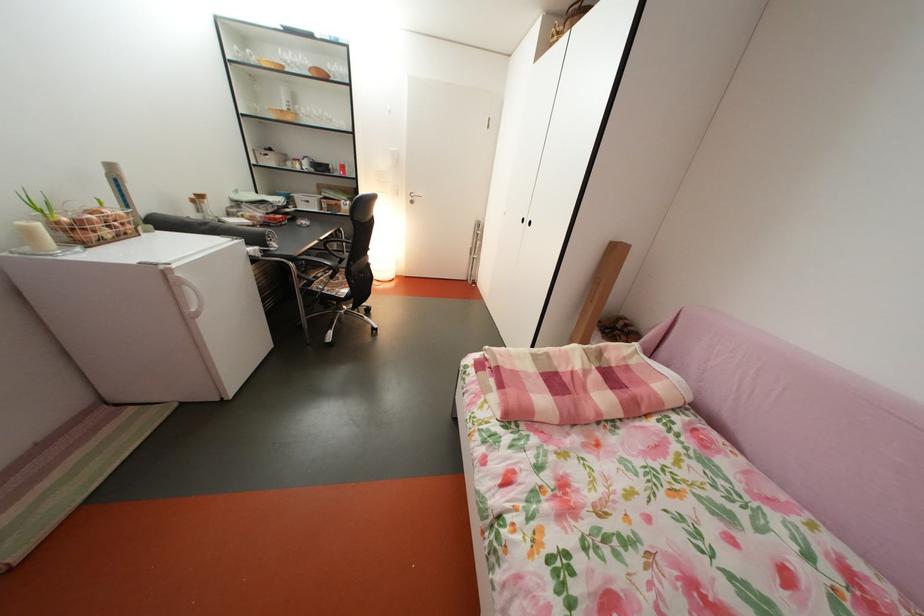
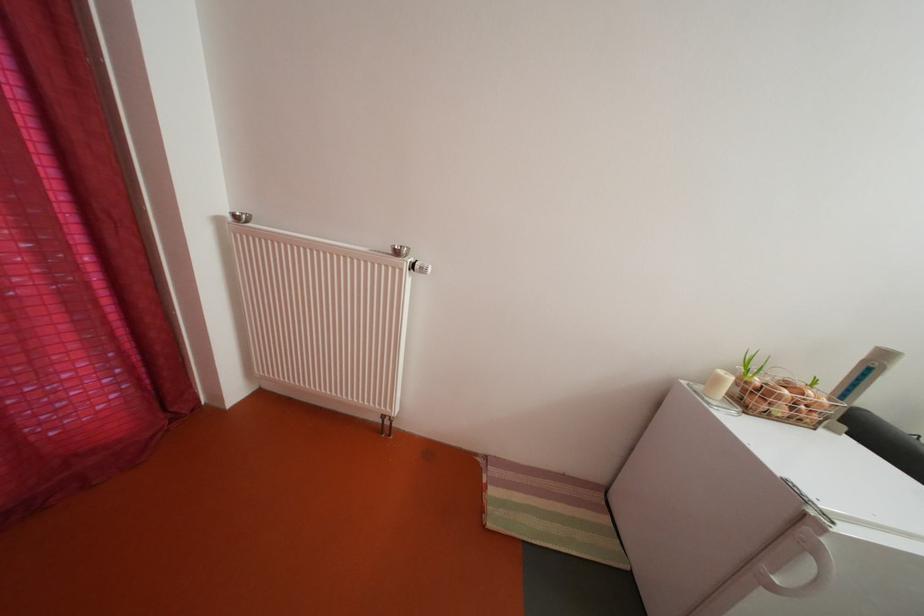
Locate, in the second image, the point that corresponds to point 118,238 in the first image.

(792, 416)